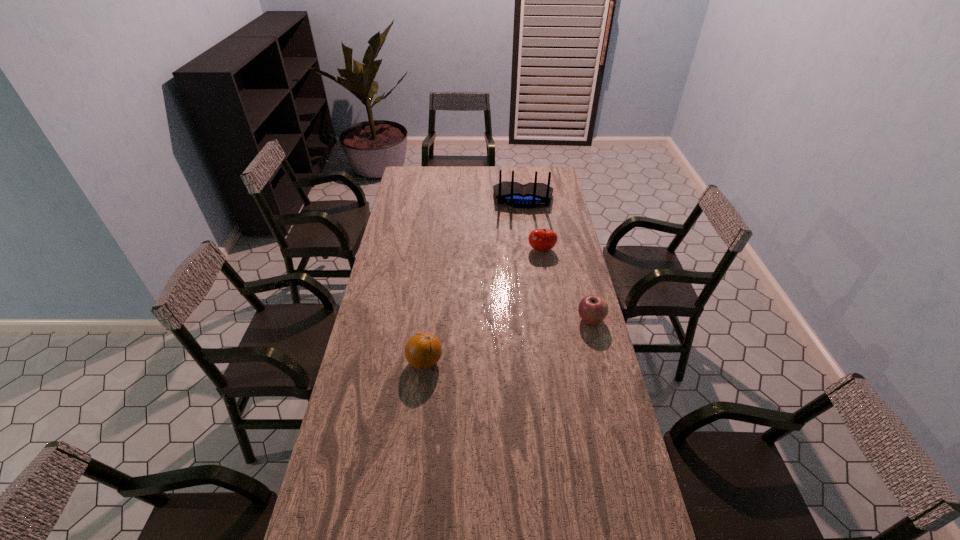
You are a GUI agent. You are given a task and a screenshot of the screen. Output one action in this format:
    pyautogui.click(x=<x>, y=<y>)
    Task: Click on the vacant space at the far left corner of the desktop
    
    Given the screenshot: What is the action you would take?
    pyautogui.click(x=427, y=178)

Locate an element on the screen. The height and width of the screenshot is (540, 960). vacant area between the orange and the third nearest object is located at coordinates (483, 306).

This screenshot has height=540, width=960. I want to click on empty space that is in between the farther apple and the nearest object, so click(x=483, y=306).

What are the coordinates of `unoccupied area between the third nearest object and the router` in the screenshot? It's located at (533, 225).

This screenshot has height=540, width=960. What are the coordinates of `free space between the orange and the left apple` in the screenshot? It's located at coord(483,306).

This screenshot has height=540, width=960. I want to click on free spot between the leftmost object and the tallest object, so click(474, 281).

Where is `vacant area between the leftmost object and the right apple`? vacant area between the leftmost object and the right apple is located at coordinates (508, 341).

The width and height of the screenshot is (960, 540). Identify the location of vacant point located between the left apple and the second nearest object. (566, 285).

You are a GUI agent. You are given a task and a screenshot of the screen. Output one action in this format:
    pyautogui.click(x=<x>, y=<y>)
    Task: Click on the free space between the second farthest object and the orange
    Image resolution: width=960 pixels, height=540 pixels.
    Given the screenshot: What is the action you would take?
    pyautogui.click(x=483, y=306)

Identify the location of empty space that is in between the tallest object and the third nearest object. (533, 225).